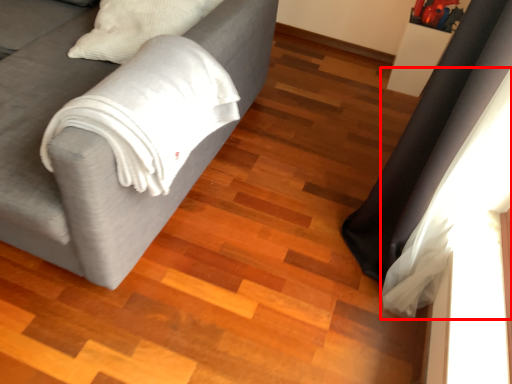
Question: Observing the image, what is the correct spatial positioning of curtain (annotated by the red box) in reference to studio couch?

Choices:
 (A) left
 (B) right

Answer: (B)